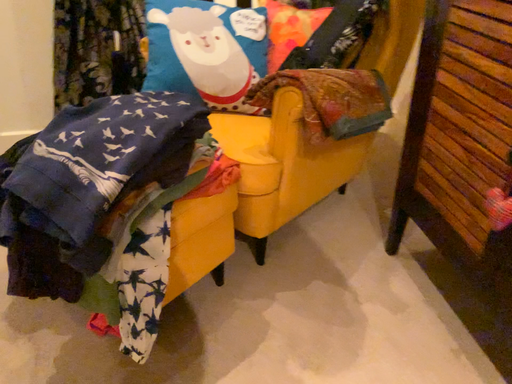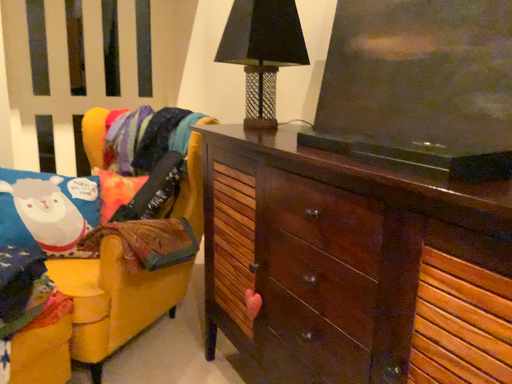
Question: Which way did the camera rotate in the video?

Choices:
 (A) rotated right
 (B) rotated left

Answer: (A)